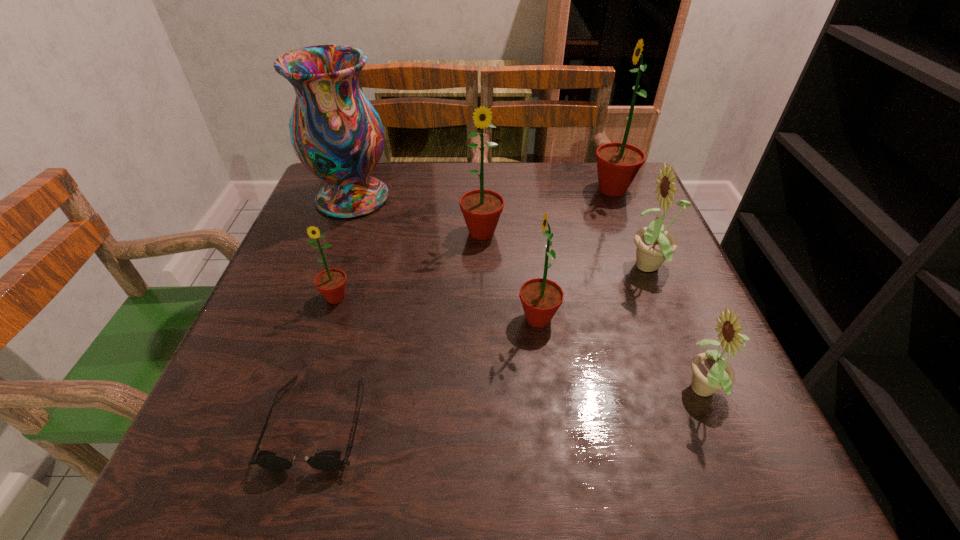
Identify the location of vacant space that's between the third biggest green sunflower and the fifth nearest sunflower. The width and height of the screenshot is (960, 540). (510, 275).

You are a GUI agent. You are given a task and a screenshot of the screen. Output one action in this format:
    pyautogui.click(x=<x>, y=<y>)
    Task: Click on the vacant point located between the second green sunflower from right to left and the vase
    The image size is (960, 540).
    Given the screenshot: What is the action you would take?
    pyautogui.click(x=445, y=258)

Locate an element on the screen. The image size is (960, 540). free area in between the fourth object from right to left and the shortest object is located at coordinates (428, 370).

In order to click on the second closest object relative to the farther yellow sunflower in this screenshot , I will do `click(617, 163)`.

Select which object is the closest to the farther yellow sunflower. Please provide its 2D coordinates. Your answer should be formatted as a tuple, i.e. [(x, y)], where the tuple contains the x and y coordinates of a point satisfying the conditions above.

[(540, 297)]

Where is `sunflower that can be found as the fifth closest to the fifth sunflower from right to left`? The width and height of the screenshot is (960, 540). sunflower that can be found as the fifth closest to the fifth sunflower from right to left is located at coordinates (711, 373).

The width and height of the screenshot is (960, 540). What are the coordinates of `sunflower that is the sixth nearest to the vase` in the screenshot? It's located at (711, 373).

Image resolution: width=960 pixels, height=540 pixels. What are the coordinates of `green sunflower that stands as the second closest to the shortest object` in the screenshot? It's located at (540, 297).

Identify which green sunflower is the nearest to the farthest green sunflower. Please provide its 2D coordinates. Your answer should be formatted as a tuple, i.e. [(x, y)], where the tuple contains the x and y coordinates of a point satisfying the conditions above.

[(481, 208)]

You are a GUI agent. You are given a task and a screenshot of the screen. Output one action in this format:
    pyautogui.click(x=<x>, y=<y>)
    Task: Click on the free space that satisfies the following two spatial constraints: 1. on the face of the tallest sunflower; 2. on the face of the fourth object from left to right
    
    Given the screenshot: What is the action you would take?
    pyautogui.click(x=629, y=232)